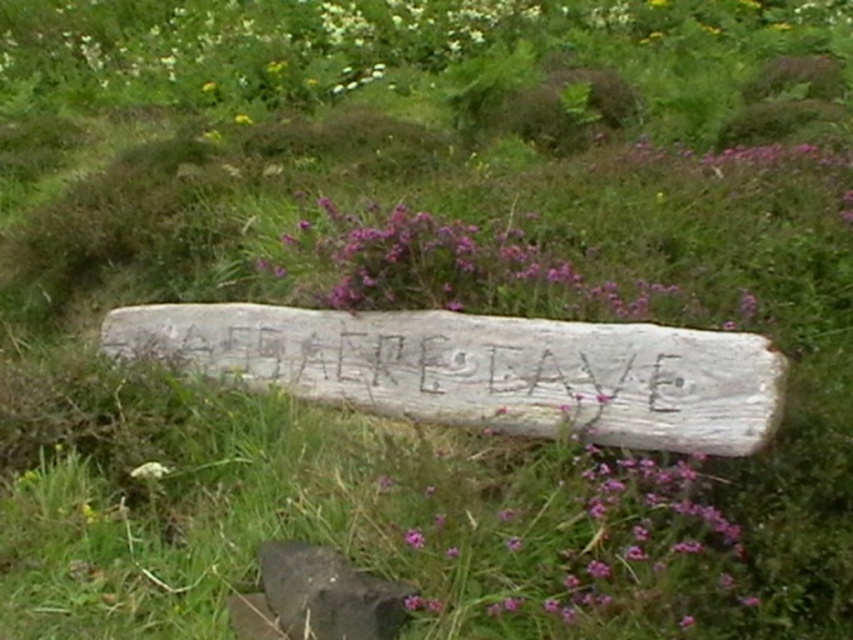
You are a gardener who wants to place a new decorative item in the garden. You have a small statue that is 10 cm wide. The purple wood at center and the white fluffy flower at lower left are already in the garden. Which object can the statue fit next to without overlapping?

The statue can fit next to the white fluffy flower at lower left because the purple wood at center is larger in size and may not leave enough space.

You are a gardener who wants to plant a new flower between the smooth gray stone at lower center and the white fluffy flower at lower left. Based on their current positions, where should you place the new flower to ensure it is between them?

The smooth gray stone at lower center is positioned on the right side of white fluffy flower at lower left, so you should place the new flower between the white fluffy flower at lower left and the smooth gray stone at lower center, closer to the white fluffy flower at lower left to maintain the spatial arrangement.